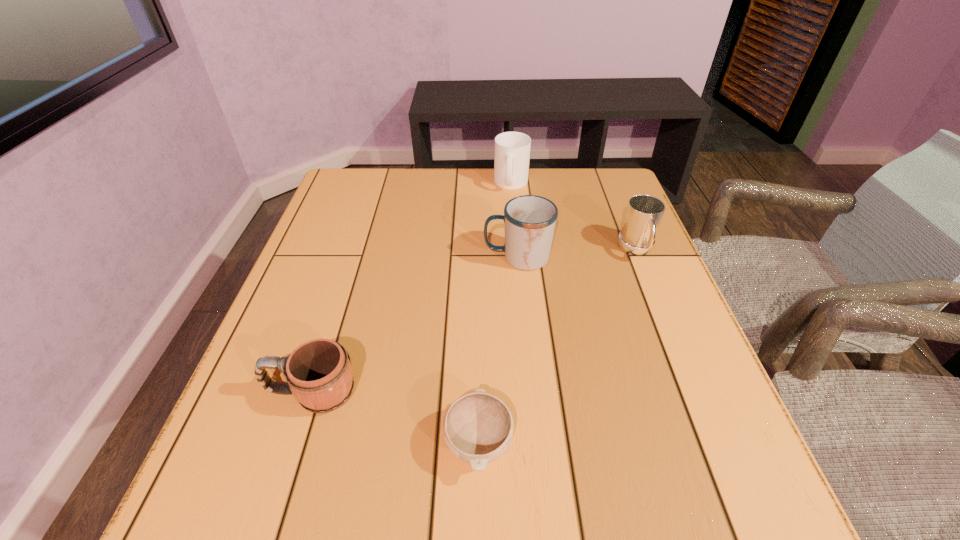
The image size is (960, 540). Find the location of `the farthest object`. the farthest object is located at coordinates (512, 149).

Locate an element on the screen. The image size is (960, 540). the rightmost mug is located at coordinates (644, 213).

The image size is (960, 540). What are the coordinates of `the nearest mug` in the screenshot? It's located at (319, 374).

This screenshot has width=960, height=540. What are the coordinates of `the leftmost object` in the screenshot? It's located at (x=319, y=374).

The image size is (960, 540). In order to click on the shortest object in this screenshot , I will do `click(478, 427)`.

This screenshot has width=960, height=540. What are the coordinates of `free point located on the handle side of the farthest object` in the screenshot? It's located at tap(519, 264).

Where is `vacant area situated on the side of the rightmost mug with the handle`? This screenshot has height=540, width=960. vacant area situated on the side of the rightmost mug with the handle is located at coordinates (707, 420).

Locate an element on the screen. The image size is (960, 540). free region located 0.110m on the back of the shortest object is located at coordinates (479, 355).

Identify the location of object that is positioned at the far edge. (512, 149).

Locate an element on the screen. object that is at the near edge is located at coordinates (478, 427).